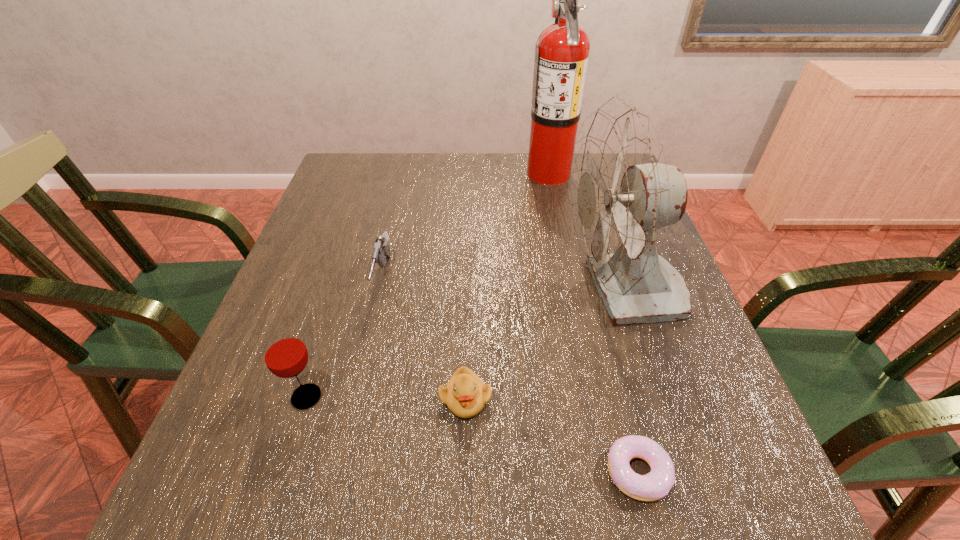
At what (x,y) coordinates should I click in order to perform the action: click on the nearest object. Please return your answer as a coordinate pair (x, y). Looking at the image, I should click on (655, 485).

Identify the location of free space located on the nozzle side of the farthest object. (399, 172).

You are a GUI agent. You are given a task and a screenshot of the screen. Output one action in this format:
    pyautogui.click(x=<x>, y=<y>)
    Task: Click on the blank area located 0.320m on the nozzle side of the farthest object
    This screenshot has width=960, height=540.
    Given the screenshot: What is the action you would take?
    coord(420,172)

The height and width of the screenshot is (540, 960). Find the location of `free space located on the nozzle side of the farthest object`. free space located on the nozzle side of the farthest object is located at coordinates (469, 172).

Where is `free space located 0.380m in front of the fifth shortest object to blow air`? This screenshot has height=540, width=960. free space located 0.380m in front of the fifth shortest object to blow air is located at coordinates (391, 293).

You are a GUI agent. You are given a task and a screenshot of the screen. Output one action in this format:
    pyautogui.click(x=<x>, y=<y>)
    Task: Click on the vacant space positioned 0.120m in front of the fifth shortest object to blow air
    The width and height of the screenshot is (960, 540).
    Given the screenshot: What is the action you would take?
    pyautogui.click(x=510, y=293)

Where is `free space located 0.160m in front of the fifth shortest object to blow air`? The image size is (960, 540). free space located 0.160m in front of the fifth shortest object to blow air is located at coordinates (492, 293).

The image size is (960, 540). In order to click on blank space located 0.310m on the back of the fourth shortest object in this screenshot , I will do `click(348, 266)`.

At what (x,y) coordinates should I click in order to perform the action: click on vacant position located 0.400m at the barrel of the gun. Please return your answer as a coordinate pair (x, y). Looking at the image, I should click on (329, 518).

Find the location of a particular element. The height and width of the screenshot is (540, 960). vacant space located 0.110m at the beak of the fourth object from right to left is located at coordinates (463, 489).